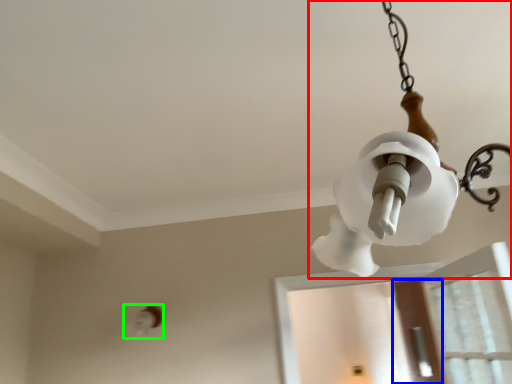
Question: Estimate the real-world distances between objects in this image. Which object is farther from lamp (highlighted by a red box), screen door (highlighted by a blue box) or light fixture (highlighted by a green box)?

Choices:
 (A) screen door
 (B) light fixture

Answer: (A)